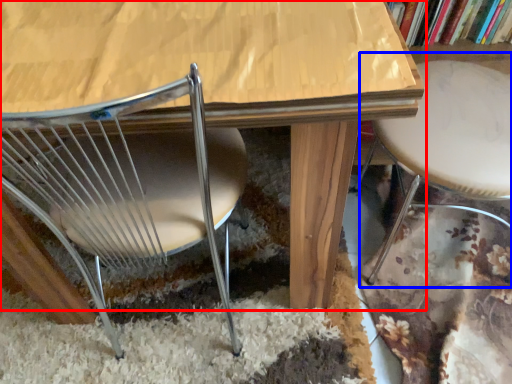
Question: Which point is closer to the camera, table (highlighted by a red box) or bar stool (highlighted by a blue box)?

Choices:
 (A) table
 (B) bar stool

Answer: (B)